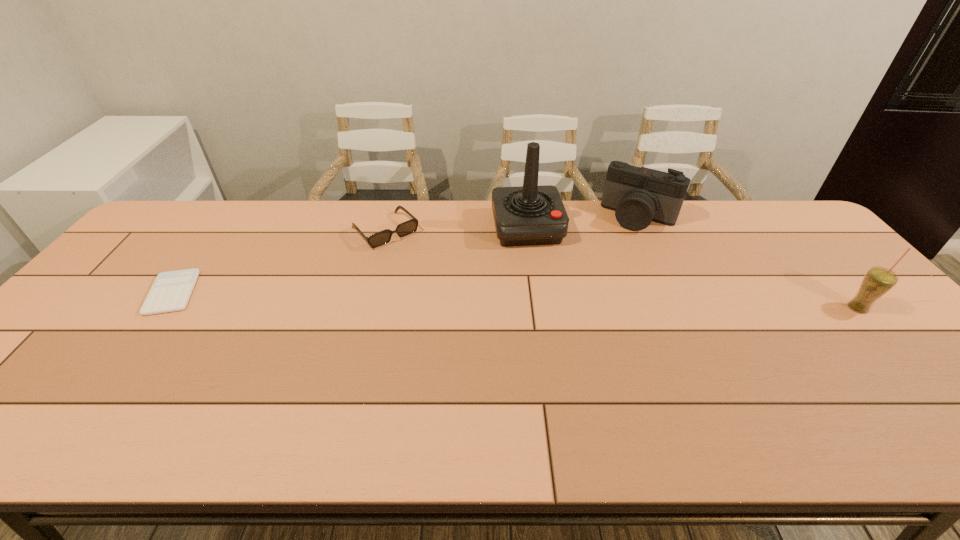
Identify the location of sunglasses that is at the far edge. This screenshot has width=960, height=540. (383, 237).

Locate an element on the screen. camera present at the far edge is located at coordinates (638, 196).

Where is `object that is at the left edge`? object that is at the left edge is located at coordinates (171, 291).

Where is `object located at the right edge`? object located at the right edge is located at coordinates (877, 281).

Where is `vacant space at the far edge of the desktop`? The height and width of the screenshot is (540, 960). vacant space at the far edge of the desktop is located at coordinates (482, 237).

Find the location of a particular element. This screenshot has width=960, height=540. vacant space at the near edge is located at coordinates (140, 399).

In the image, there is a desktop. Identify the location of vacant space at the left edge. (44, 342).

In the image, there is a desktop. Find the location of `vacant space at the right edge`. vacant space at the right edge is located at coordinates (910, 338).

This screenshot has width=960, height=540. Identify the location of vacant region at the far left corner of the desktop. (174, 212).

This screenshot has width=960, height=540. I want to click on free space at the near left corner of the desktop, so coord(68,386).